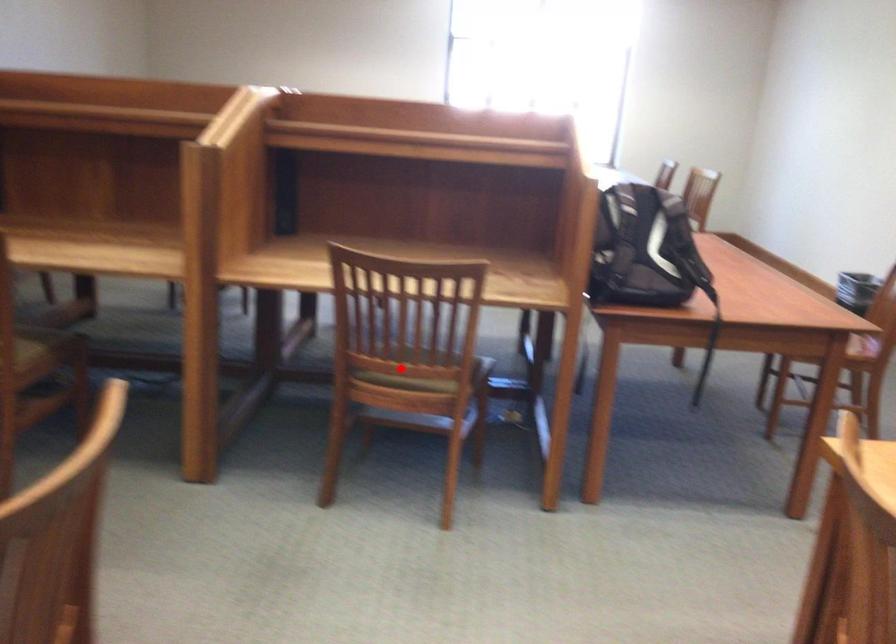
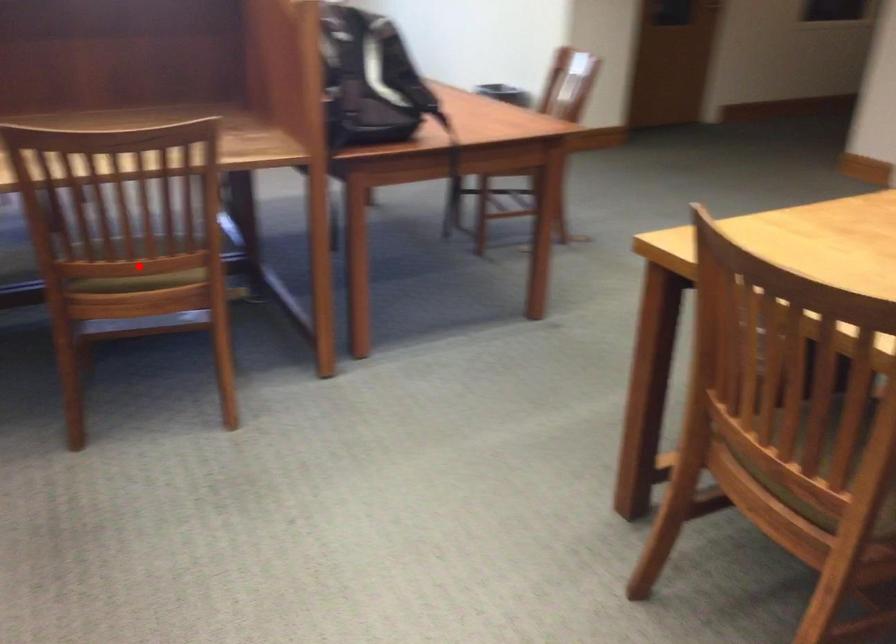
I am providing you with two images of the same scene from different viewpoints. A red point is marked on the first image and another point is marked on the second image. Does the point marked in image1 correspond to the same location as the one in image2?

Yes